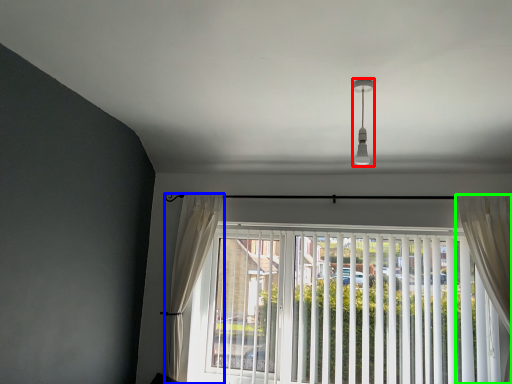
Question: Based on their relative distances, which object is nearer to light fixture (highlighted by a red box)? Choose from curtain (highlighted by a blue box) and curtain (highlighted by a green box).

Choices:
 (A) curtain
 (B) curtain

Answer: (B)